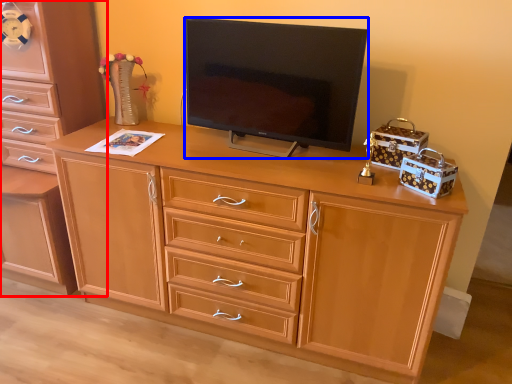
Question: Which object is closer to the camera taking this photo, chest of drawers (highlighted by a red box) or television (highlighted by a blue box)?

Choices:
 (A) chest of drawers
 (B) television

Answer: (B)